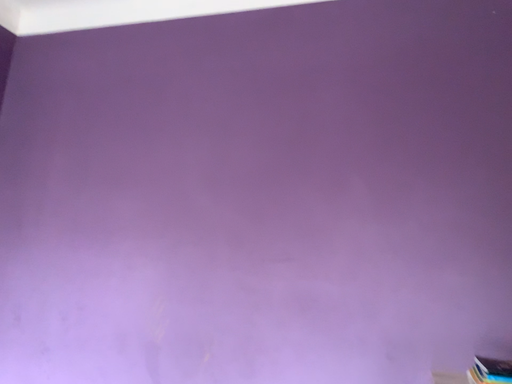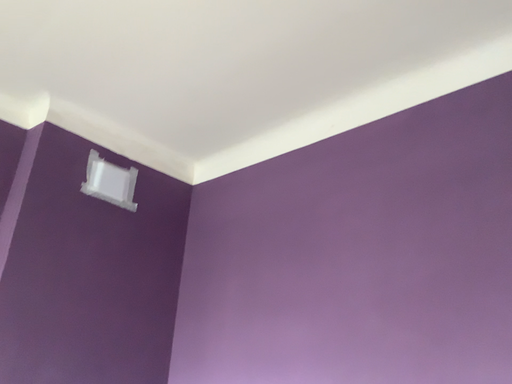
Question: Which way did the camera rotate in the video?

Choices:
 (A) rotated left
 (B) rotated right

Answer: (A)